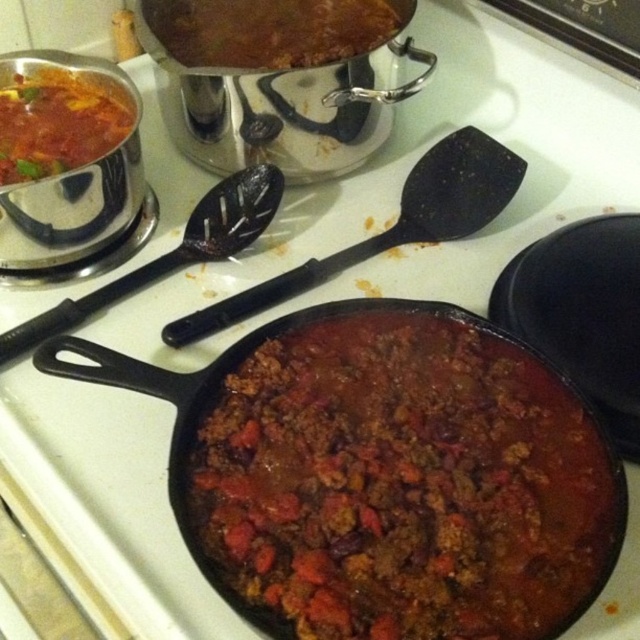
Consider the image. You are a chef preparing to serve a meal. You have a brown matte pot at upper center and a matte black chili at upper left. Which container can hold more food based on their sizes?

The brown matte pot at upper center can hold more food because its width is larger than the matte black chili at upper left.

You are a chef who needs to select the taller chili between the brown matte chili at center and the matte black chili at upper left. Which one should you choose?

The brown matte chili at center is taller than the matte black chili at upper left, so you should choose the brown matte chili at center.

You are holding a 12 inch ruler. You want to measure the distance from your current position to the point at coordinates point (545, 560). Can you reach it with your ruler?

The distance between you and the point (545, 560) is 21.39 inches, so the ruler is not long enough to reach it since it is only 12 inches long.